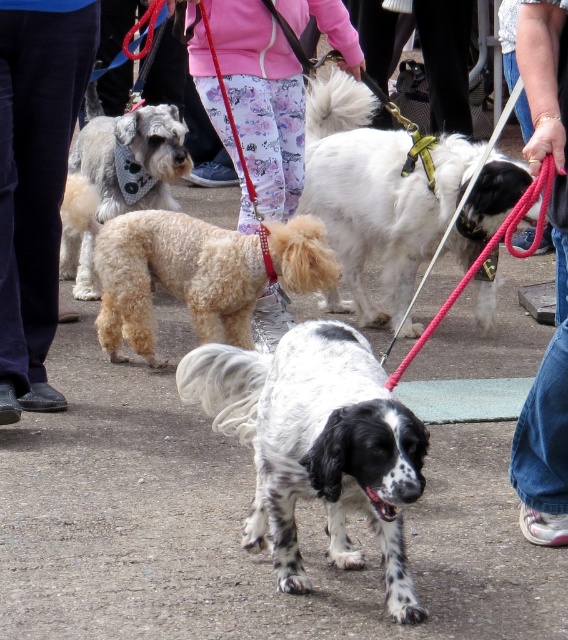
You are standing at the camera position and want to take a photo of the black and white English Springer Spaniel. There is a point at coordinates point (356, 436) that is 3.46 meters away from you. Is the English Springer Spaniel closer to you than that point?

The point at (356, 436) is 3.46 meters away from the camera. Since the English Springer Spaniel is in the foreground, it is closer to the camera than the point, so yes, the dog is closer.

You are a photographer at a dog show. You want to take a photo of the speckled fur dog at center and the white fluffy dog at center. Which dog should you focus on first to ensure both are in focus?

The speckled fur dog at center is in front of the white fluffy dog at center, so you should focus on the speckled fur dog at center first to ensure both are in focus.

From the picture: You are a photographer at a dog show. You need to position yourself so that both the speckled fur dog at center and the fluffy beige dog at lower left are in frame. Based on their positions, which dog should you focus on first to ensure both are visible?

The speckled fur dog at center is below the fluffy beige dog at lower left, so you should focus on the fluffy beige dog at lower left first to ensure both are in frame.